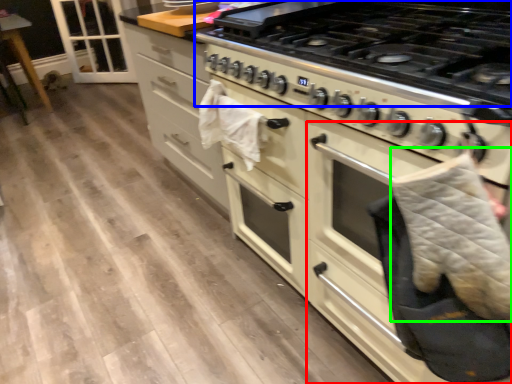
Question: Estimate the real-world distances between objects in this image. Which object is farther from oven (highlighted by a red box), gas stove (highlighted by a blue box) or blanket (highlighted by a green box)?

Choices:
 (A) gas stove
 (B) blanket

Answer: (A)